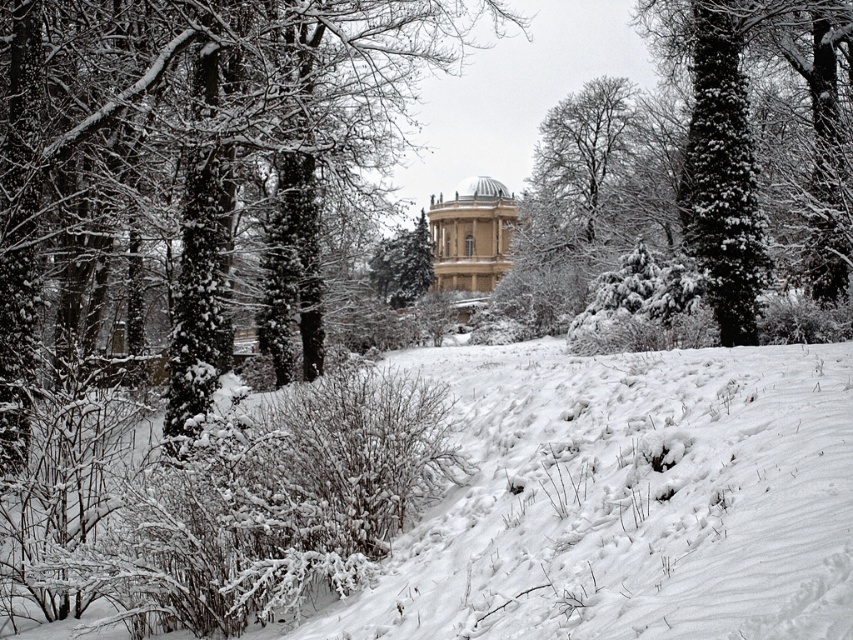
You are planning to build a snowman using the white fluffy snow at center and want to place it near the white marble gazebo at center. Based on their sizes, which one is wider?

The white fluffy snow at center might be wider than the white marble gazebo at center according to the description.